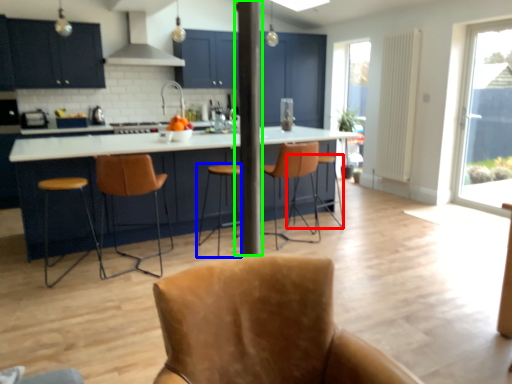
Question: Which is nearer to the bar stool (highlighted by a red box)? bar stool (highlighted by a blue box) or pole (highlighted by a green box).

Choices:
 (A) bar stool
 (B) pole

Answer: (A)